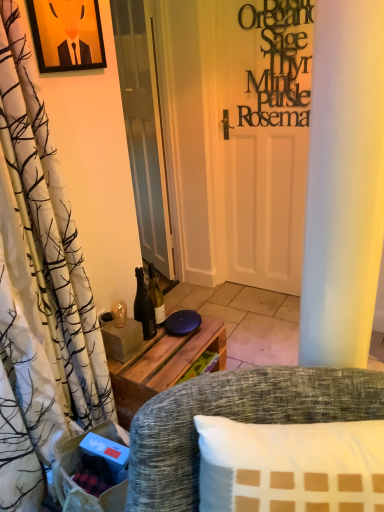
Question: Is white glossy door at center a part of shiny glass bottle at center?

Choices:
 (A) no
 (B) yes

Answer: (A)

Question: Is the position of shiny glass bottle at center less distant than that of white glossy door at center?

Choices:
 (A) no
 (B) yes

Answer: (B)

Question: Can you confirm if shiny glass bottle at center is taller than white glossy door at center?

Choices:
 (A) yes
 (B) no

Answer: (B)

Question: Are shiny glass bottle at center and white glossy door at center located far from each other?

Choices:
 (A) yes
 (B) no

Answer: (A)

Question: From a real-world perspective, does shiny glass bottle at center stand above white glossy door at center?

Choices:
 (A) yes
 (B) no

Answer: (B)

Question: Is shiny glass bottle at center completely or partially outside of white glossy door at center?

Choices:
 (A) no
 (B) yes

Answer: (B)

Question: Is shiny glass bottle at center surrounded by white glossy door at center?

Choices:
 (A) yes
 (B) no

Answer: (B)

Question: From a real-world perspective, is white glossy door at center beneath shiny glass bottle at center?

Choices:
 (A) yes
 (B) no

Answer: (B)

Question: Is white glossy door at center facing away from shiny glass bottle at center?

Choices:
 (A) no
 (B) yes

Answer: (A)

Question: Are white glossy door at center and shiny glass bottle at center far apart?

Choices:
 (A) yes
 (B) no

Answer: (A)

Question: Considering the relative sizes of white glossy door at center and shiny glass bottle at center in the image provided, is white glossy door at center bigger than shiny glass bottle at center?

Choices:
 (A) yes
 (B) no

Answer: (A)

Question: Is white glossy door at center smaller than shiny glass bottle at center?

Choices:
 (A) no
 (B) yes

Answer: (A)

Question: Can you confirm if matte black picture frame at upper left is bigger than white glossy door at center?

Choices:
 (A) no
 (B) yes

Answer: (A)